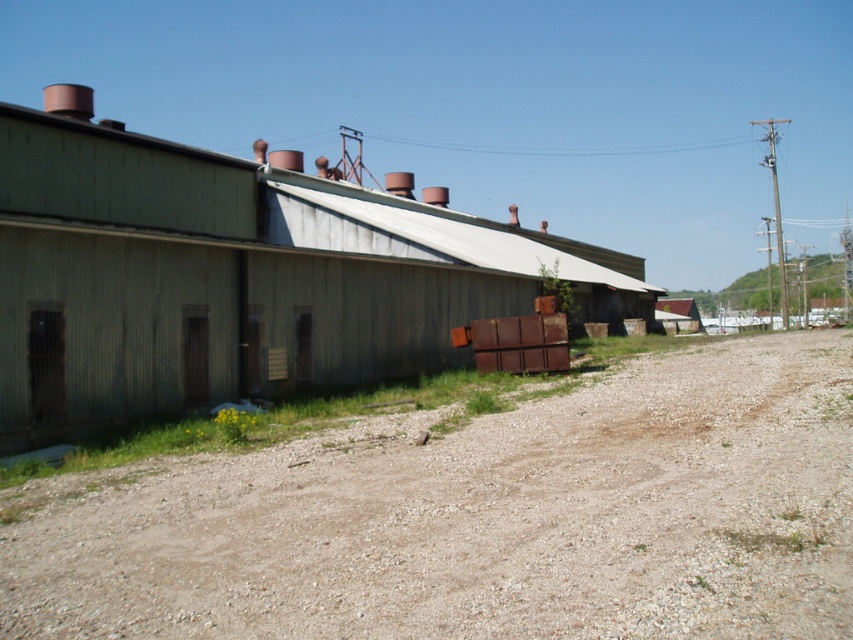
You are a delivery driver who needs to park your truck near the green corrugated metal barn at center. The truck requires a minimum of 50 feet of space to maneuver safely. Based on the scene, can you safely park your truck on the brown gravel dirt track at center?

The brown gravel dirt track at center is 55.72 feet away from the green corrugated metal barn at center. Since the required space is 50 feet, the track provides sufficient space for the truck to park safely.

You are standing at the entrance of the industrial building and want to walk to the brown gravel dirt track at center. Which direction should you head towards?

The brown gravel dirt track at center is located at point (488,518), so you should head towards the center of the image to reach it.

You are a delivery driver approaching the brown gravel dirt track at center and the green corrugated metal barn at center. Which object will you encounter first?

The brown gravel dirt track at center is closer to the viewer than the green corrugated metal barn at center, so you will encounter the brown gravel dirt track at center first.